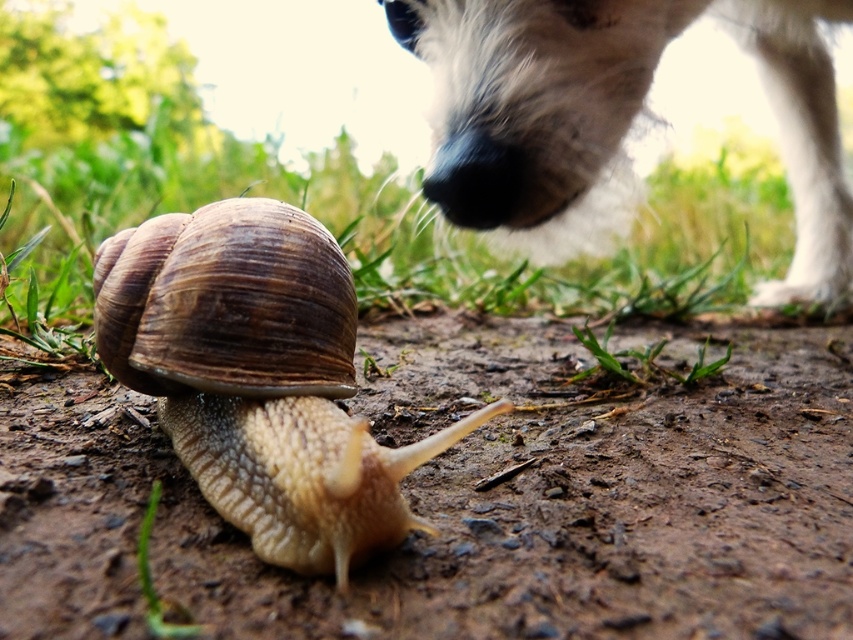
Question: In this image, where is brown textured shell at center located relative to green grass at lower left?

Choices:
 (A) right
 (B) left

Answer: (A)

Question: Among these objects, which one is nearest to the camera?

Choices:
 (A) white fluffy dog at upper right
 (B) brown textured shell at center
 (C) green grass at lower left

Answer: (B)

Question: Does brown textured shell at center appear on the left side of white fluffy dog at upper right?

Choices:
 (A) no
 (B) yes

Answer: (B)

Question: Considering the relative positions of brown textured shell at center and white fluffy dog at upper right in the image provided, where is brown textured shell at center located with respect to white fluffy dog at upper right?

Choices:
 (A) below
 (B) above

Answer: (A)

Question: Which of these objects is positioned closest to the brown textured shell at center?

Choices:
 (A) green grass at lower left
 (B) white fluffy dog at upper right

Answer: (A)

Question: Among these objects, which one is farthest from the camera?

Choices:
 (A) brown textured shell at center
 (B) white fluffy dog at upper right

Answer: (B)